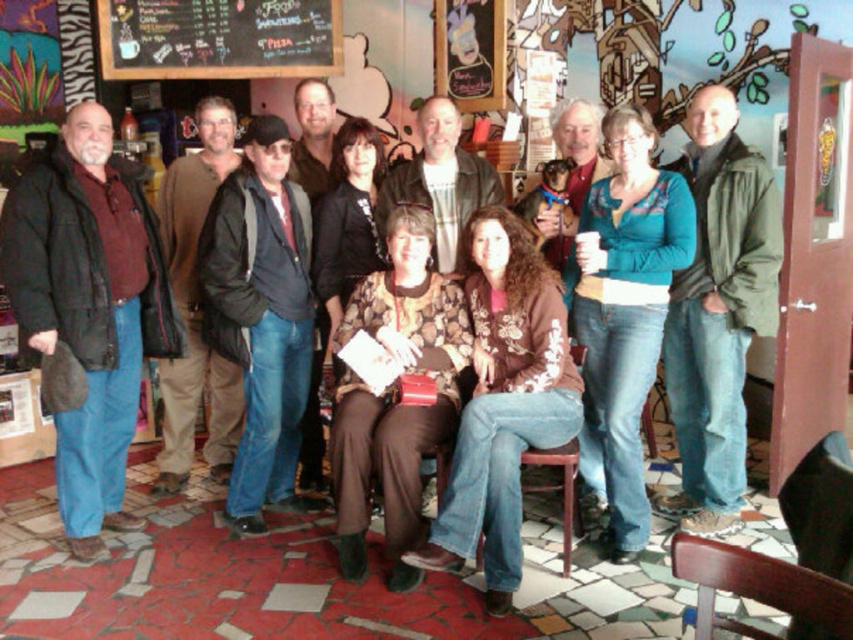
Question: Among these objects, which one is farthest from the camera?

Choices:
 (A) matte black jacket at left
 (B) brown leather jacket at left
 (C) green matte jacket at center

Answer: (B)

Question: Which object is the closest to the matte black jacket at left?

Choices:
 (A) brown leather jacket at center
 (B) black chalkboard menu at upper center
 (C) green matte jacket at center
 (D) matte brown jacket at center

Answer: (D)

Question: Does brown leather jacket at center come in front of matte brown jacket at center?

Choices:
 (A) no
 (B) yes

Answer: (B)

Question: Is brown leather jacket at left in front of brown leather jacket at center?

Choices:
 (A) yes
 (B) no

Answer: (B)

Question: Considering the real-world distances, which object is farthest from the brown leather jacket at left?

Choices:
 (A) matte black jacket at left
 (B) brown leather jacket at center
 (C) matte brown jacket at center

Answer: (B)

Question: Does floral-patterned sweater at center appear over black chalkboard menu at upper center?

Choices:
 (A) no
 (B) yes

Answer: (A)